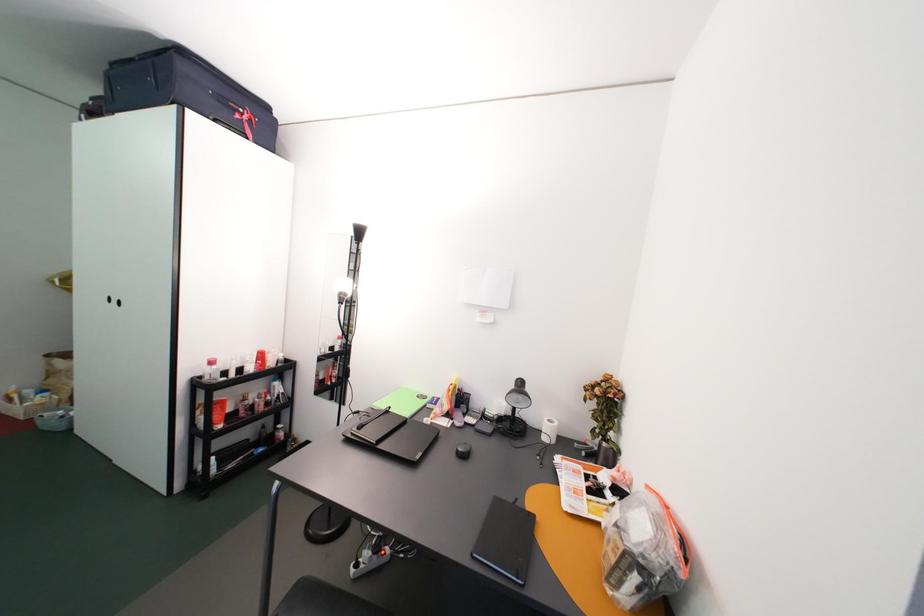
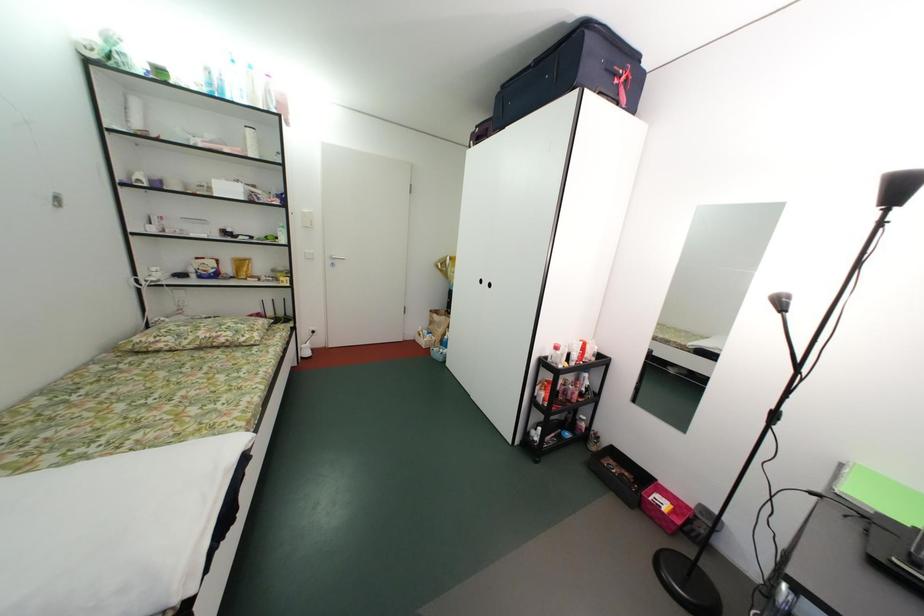
Question: How did the camera likely rotate?

Choices:
 (A) Left
 (B) Right
 (C) Up
 (D) Down

Answer: (A)